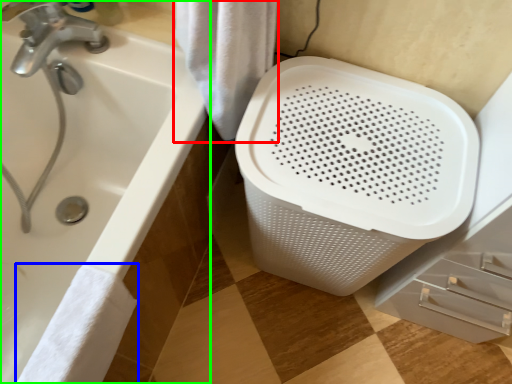
Question: Which object is positioned closest to bath towel (highlighted by a red box)? Select from bath towel (highlighted by a blue box) and bathtub (highlighted by a green box).

Choices:
 (A) bath towel
 (B) bathtub

Answer: (B)